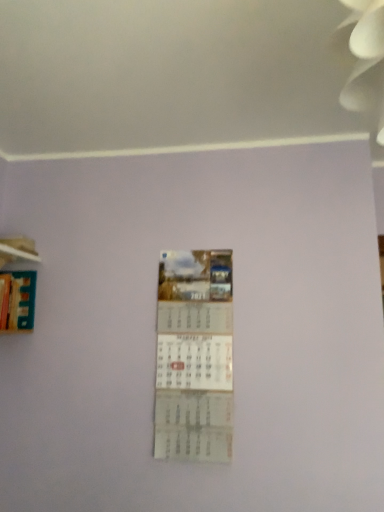
Question: From a real-world perspective, does white paper calendar at center stand above hardcover book at left?

Choices:
 (A) no
 (B) yes

Answer: (A)

Question: Can you confirm if white paper calendar at center is taller than hardcover book at left?

Choices:
 (A) no
 (B) yes

Answer: (B)

Question: From the image's perspective, is white paper calendar at center under hardcover book at left?

Choices:
 (A) no
 (B) yes

Answer: (B)

Question: Does white paper calendar at center appear on the right side of hardcover book at left?

Choices:
 (A) no
 (B) yes

Answer: (B)

Question: Can you confirm if white paper calendar at center is bigger than hardcover book at left?

Choices:
 (A) yes
 (B) no

Answer: (B)

Question: From a real-world perspective, is hardcover book at left above or below white paper calendar at center?

Choices:
 (A) above
 (B) below

Answer: (A)

Question: Considering the positions of hardcover book at left and white paper calendar at center in the image, is hardcover book at left wider or thinner than white paper calendar at center?

Choices:
 (A) wide
 (B) thin

Answer: (A)

Question: From the image's perspective, relative to white paper calendar at center, is hardcover book at left above or below?

Choices:
 (A) below
 (B) above

Answer: (B)

Question: Considering the positions of hardcover book at left and white paper calendar at center in the image, is hardcover book at left bigger or smaller than white paper calendar at center?

Choices:
 (A) small
 (B) big

Answer: (B)

Question: From the image's perspective, is wooden at left located above or below white paper calendar at center?

Choices:
 (A) above
 (B) below

Answer: (A)

Question: Based on their positions, is wooden at left located to the left or right of white paper calendar at center?

Choices:
 (A) left
 (B) right

Answer: (A)

Question: Is wooden at left taller or shorter than white paper calendar at center?

Choices:
 (A) short
 (B) tall

Answer: (A)

Question: Is wooden at left inside or outside of white paper calendar at center?

Choices:
 (A) outside
 (B) inside

Answer: (A)

Question: Choose the correct answer: Is hardcover book at left inside wooden at left or outside it?

Choices:
 (A) inside
 (B) outside

Answer: (B)

Question: From a real-world perspective, is hardcover book at left above or below wooden at left?

Choices:
 (A) below
 (B) above

Answer: (A)